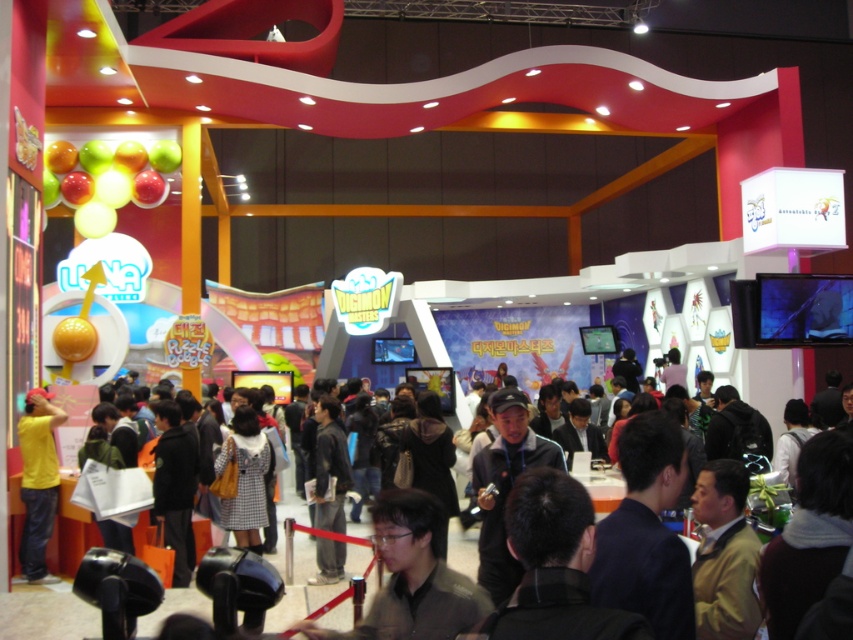
Is point (282, 605) positioned behind point (36, 516)?

No, (282, 605) is closer to viewer.

Who is taller, dark brown leather jacket at center or yellow matte shirt at left?

dark brown leather jacket at center is taller.

Where is `dark brown leather jacket at center`? dark brown leather jacket at center is located at coordinates (45, 612).